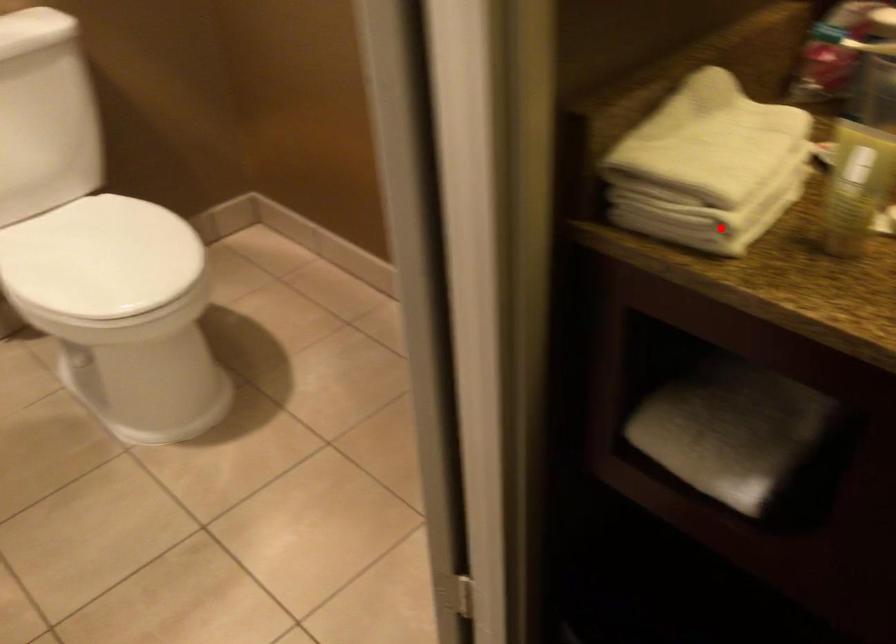
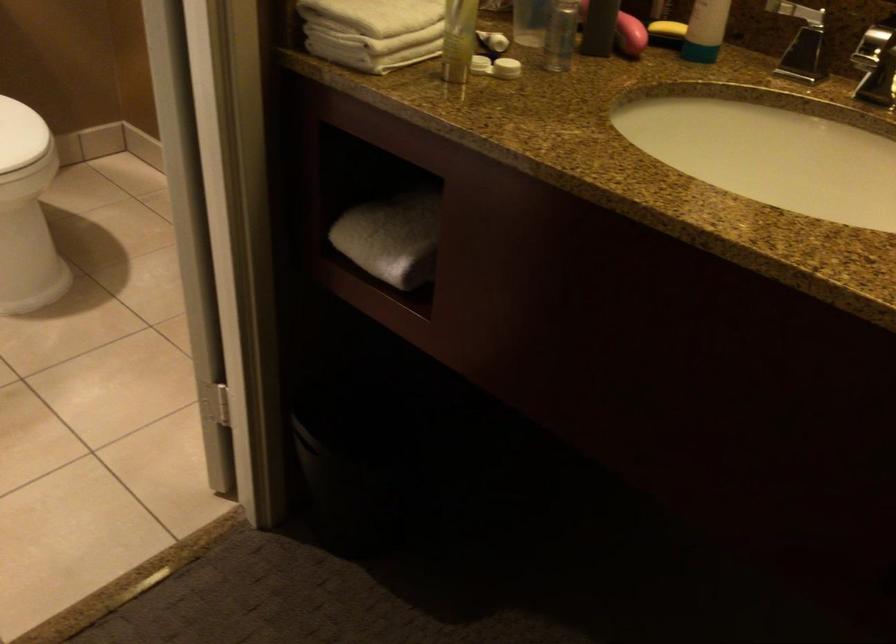
Question: I am providing you with two images of the same scene from different viewpoints. In image1, a red point is highlighted. Considering the same 3D point in image2, which of the following is correct?

Choices:
 (A) It is closer
 (B) It is farther

Answer: (B)